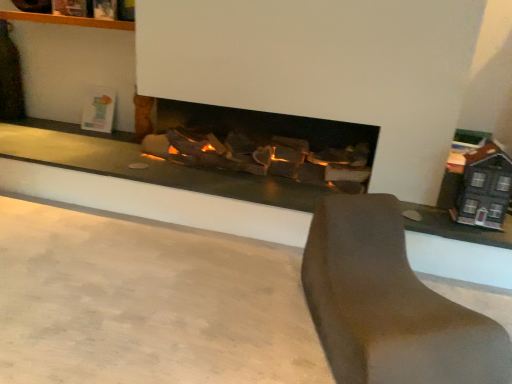
Question: Is smooth concrete at center wider or thinner than brown matte chair at lower right?

Choices:
 (A) thin
 (B) wide

Answer: (B)

Question: From a real-world perspective, is smooth concrete at center positioned above or below brown matte chair at lower right?

Choices:
 (A) below
 (B) above

Answer: (A)

Question: In terms of height, does smooth concrete at center look taller or shorter compared to brown matte chair at lower right?

Choices:
 (A) tall
 (B) short

Answer: (B)

Question: Considering the positions of point (492, 322) and point (95, 233), is point (492, 322) closer or farther from the camera than point (95, 233)?

Choices:
 (A) closer
 (B) farther

Answer: (A)

Question: Based on their sizes in the image, would you say brown matte chair at lower right is bigger or smaller than smooth concrete at center?

Choices:
 (A) big
 (B) small

Answer: (A)

Question: Is brown matte chair at lower right wider or thinner than smooth concrete at center?

Choices:
 (A) thin
 (B) wide

Answer: (A)

Question: From a real-world perspective, is brown matte chair at lower right physically located above or below smooth concrete at center?

Choices:
 (A) below
 (B) above

Answer: (B)